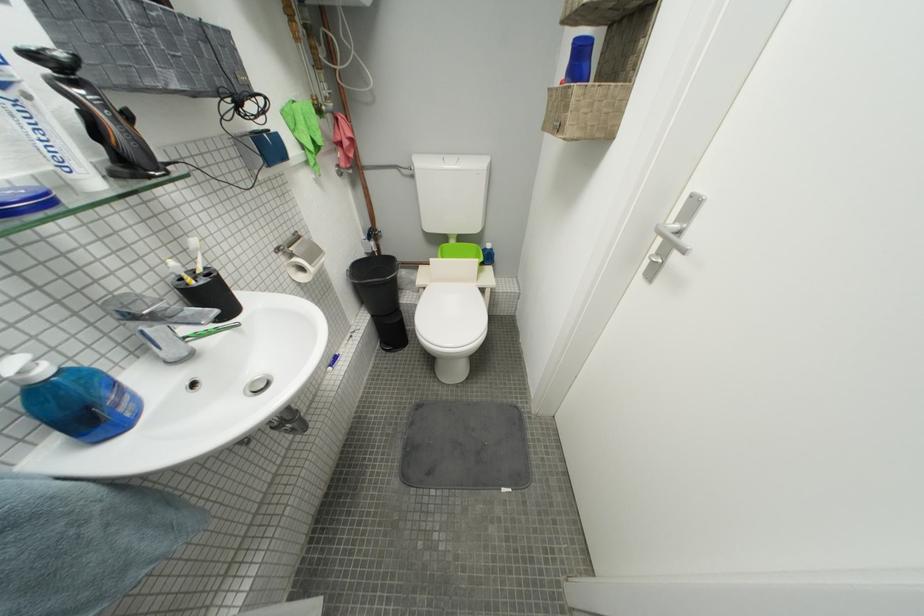
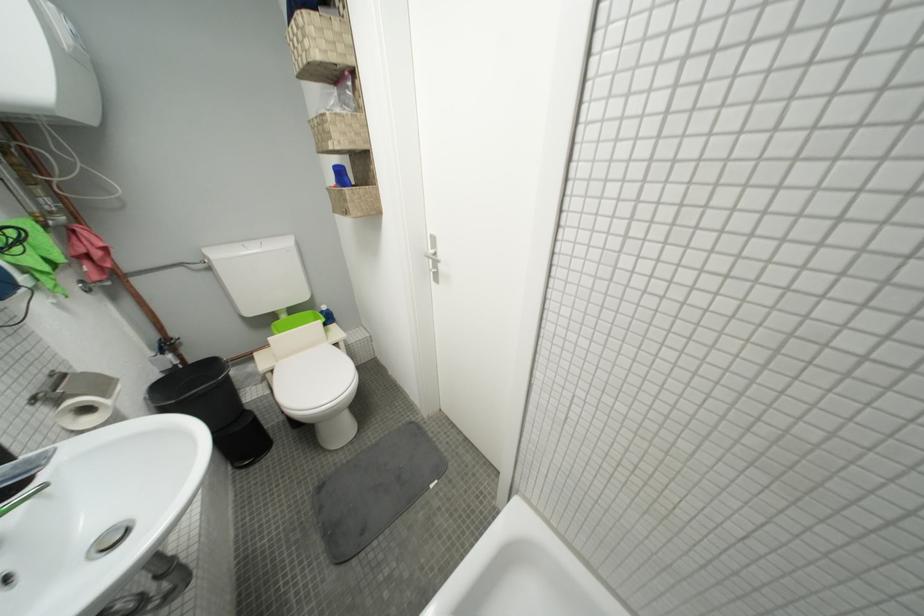
Locate, in the second image, the point that corresponds to (320,265) in the first image.

(113, 397)